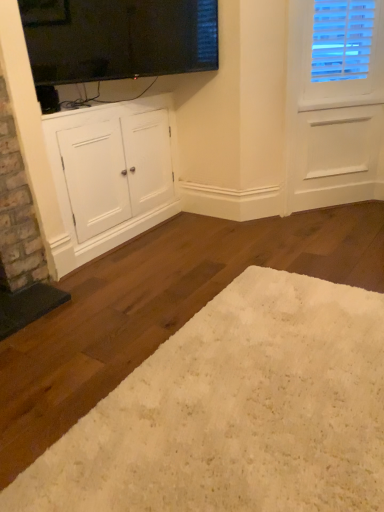
Where is `vacant space situated above white shag rug at lower center (from a real-world perspective)`? vacant space situated above white shag rug at lower center (from a real-world perspective) is located at coordinates (248, 394).